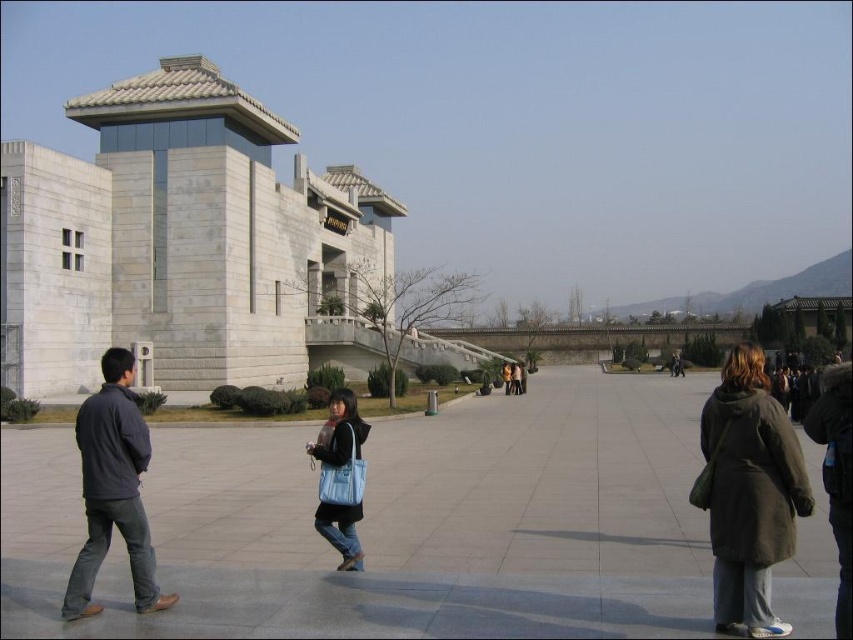
Question: Which of these objects is positioned closest to the dark gray fleece jacket at lower left?

Choices:
 (A) dark gray fur coat at lower right
 (B) matte blue bag at center

Answer: (B)

Question: Can you confirm if dark gray fur coat at lower right is positioned above dark gray fleece jacket at lower left?

Choices:
 (A) no
 (B) yes

Answer: (A)

Question: Is dark gray fur coat at lower right further to camera compared to dark gray fleece jacket at lower left?

Choices:
 (A) no
 (B) yes

Answer: (A)

Question: Is dark gray fleece jacket at lower left positioned behind matte blue bag at center?

Choices:
 (A) yes
 (B) no

Answer: (B)

Question: Which of the following is the farthest from the observer?

Choices:
 (A) matte blue bag at center
 (B) white stone building at left

Answer: (B)

Question: Which of the following is the closest to the observer?

Choices:
 (A) (347, 417)
 (B) (231, 234)
 (C) (123, 509)
 (D) (769, 472)

Answer: (D)